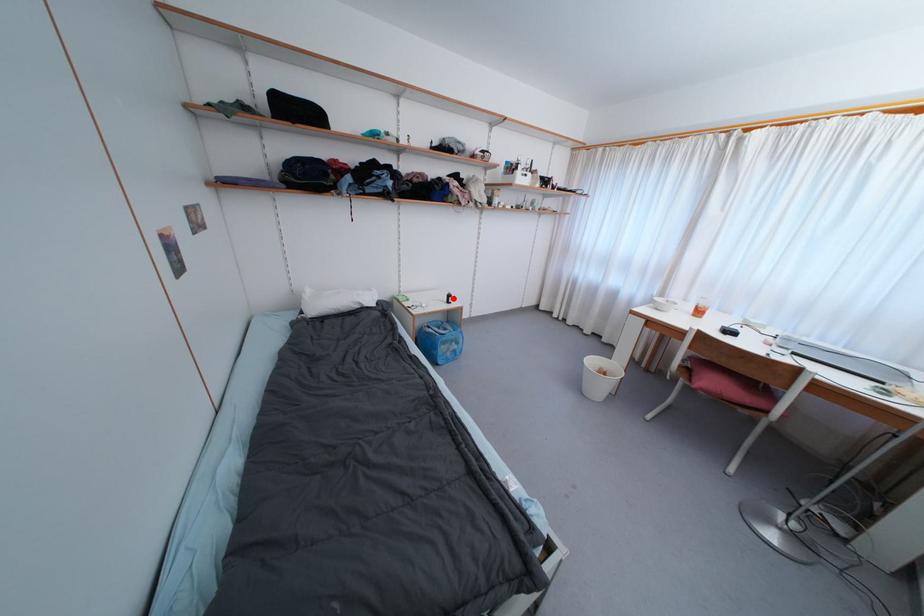
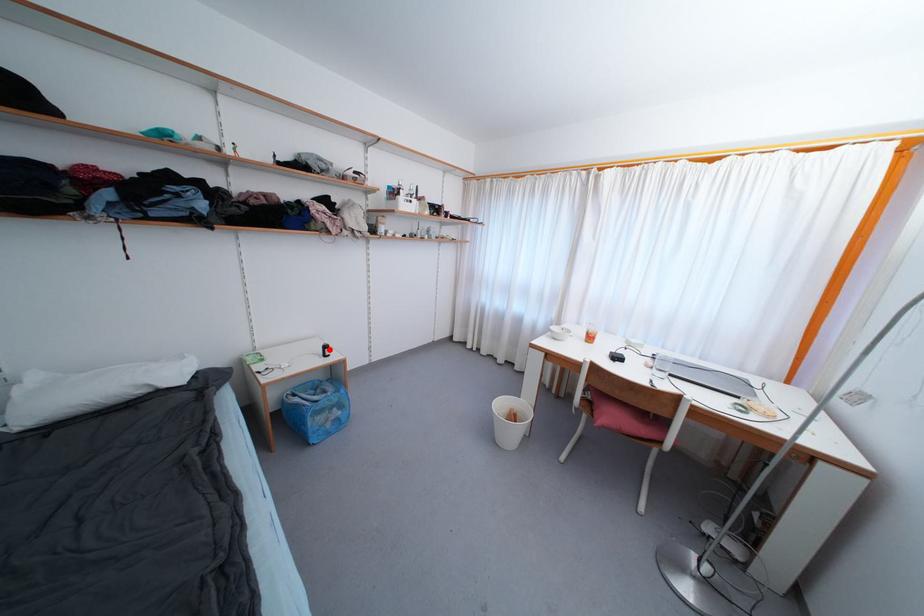
I am providing you with two images of the same scene from different viewpoints. A red point is marked on the first image and another point is marked on the second image. Do the highlighted points in image1 and image2 indicate the same real-world spot?

Yes